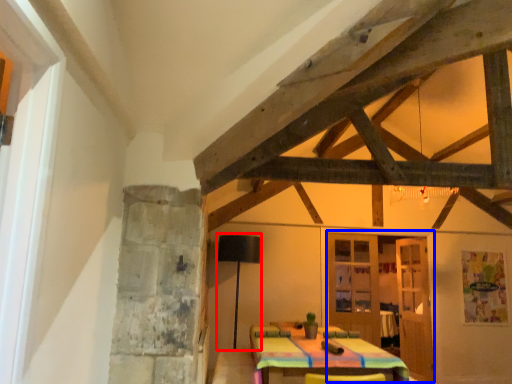
Question: Which of the following is the farthest to the observer, lamp (highlighted by a red box) or door (highlighted by a blue box)?

Choices:
 (A) lamp
 (B) door

Answer: (B)